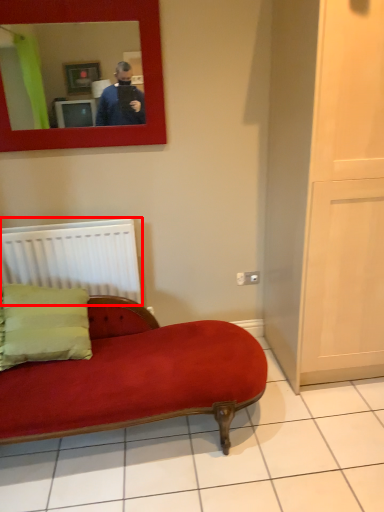
Question: Where is radiator (annotated by the red box) located in relation to mirror in the image?

Choices:
 (A) right
 (B) left

Answer: (B)